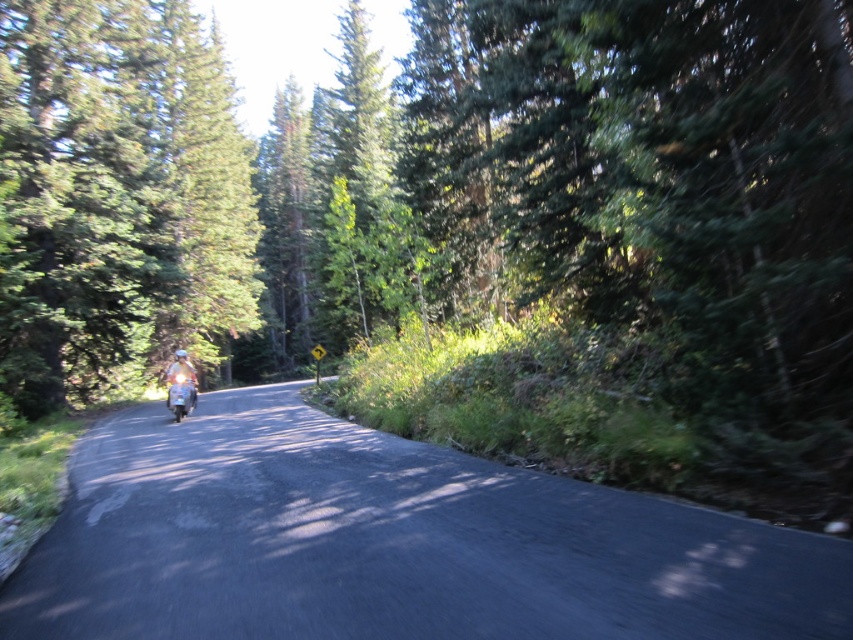
Question: Which point is closer to the camera taking this photo?

Choices:
 (A) (119, 218)
 (B) (195, 376)

Answer: (B)

Question: Among these points, which one is nearest to the camera?

Choices:
 (A) (219, 116)
 (B) (192, 397)

Answer: (B)

Question: Can you confirm if shiny silver motorcycle at center is bigger than metallic silver helmet at center?

Choices:
 (A) yes
 (B) no

Answer: (B)

Question: Among these objects, which one is nearest to the camera?

Choices:
 (A) shiny silver motorcycle at center
 (B) green textured tree at left
 (C) metallic silver helmet at center

Answer: (B)

Question: Is shiny silver motorcycle at center thinner than metallic silver helmet at center?

Choices:
 (A) no
 (B) yes

Answer: (B)

Question: Is green textured tree at left below shiny silver motorcycle at center?

Choices:
 (A) yes
 (B) no

Answer: (B)